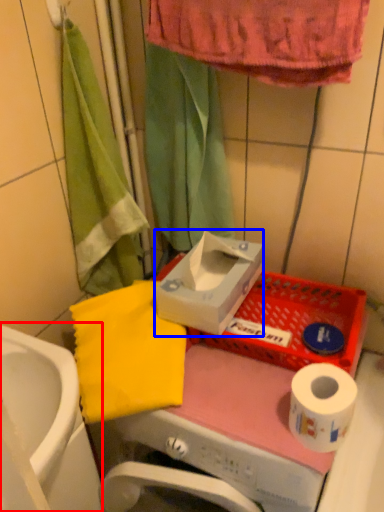
Question: Which object appears farthest to the camera in this image, sink (highlighted by a red box) or carton (highlighted by a blue box)?

Choices:
 (A) sink
 (B) carton

Answer: (B)